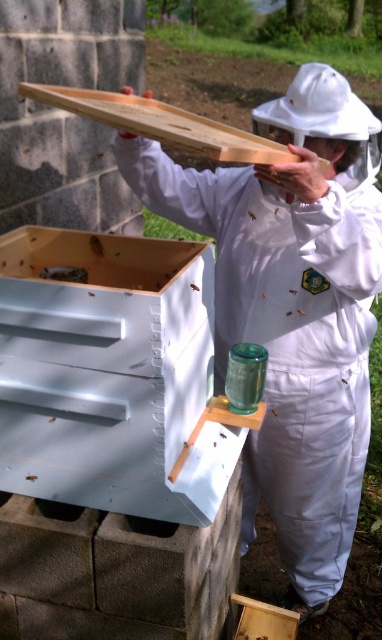
Question: Can you confirm if white painted wood beehive at lower left is smaller than translucent yellowish honeycomb at upper center?

Choices:
 (A) yes
 (B) no

Answer: (B)

Question: Is white painted wood beehive at lower left further to the viewer compared to translucent plastic bee at upper center?

Choices:
 (A) yes
 (B) no

Answer: (B)

Question: Among these points, which one is nearest to the camera?

Choices:
 (A) (111, 438)
 (B) (372, 269)
 (C) (252, 216)
 (D) (189, 284)

Answer: (A)

Question: Which is nearer to the translucent plastic bee at upper center?

Choices:
 (A) translucent yellowish honeycomb at upper center
 (B) translucent glass jar at upper center
 (C) white painted wood beehive at lower left

Answer: (A)

Question: Is white painted wood beehive at lower left wider than translucent yellowish honeycomb at upper center?

Choices:
 (A) yes
 (B) no

Answer: (A)

Question: Which object is positioned farthest from the translucent yellowish honeycomb at upper center?

Choices:
 (A) translucent glass jar at upper center
 (B) white painted wood beehive at lower left
 (C) white matte beekeeper suit at center

Answer: (B)